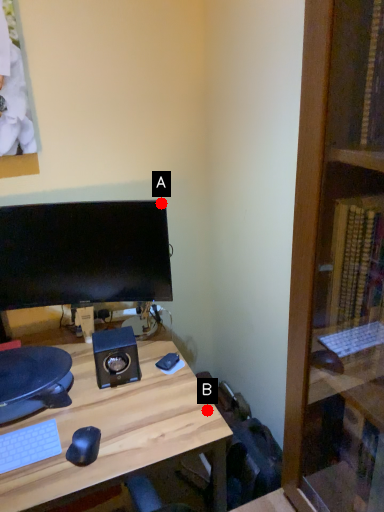
Question: Two points are circled on the image, labeled by A and B beside each circle. Which point is farther to the camera?

Choices:
 (A) A is further
 (B) B is further

Answer: (A)